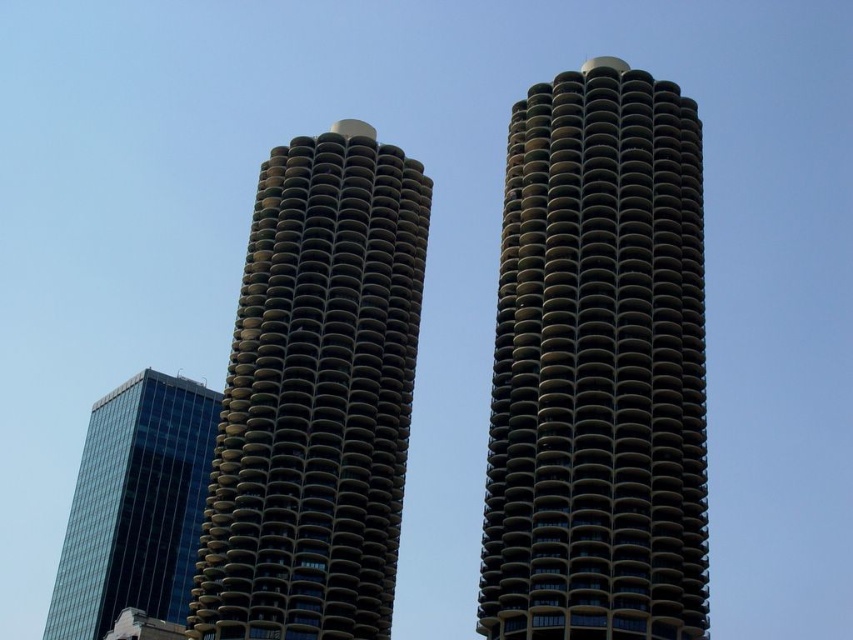
Who is more distant from viewer, (577, 504) or (97, 515)?

Point (97, 515)

Can you confirm if dark brown concrete tower at center is wider than transparent glass skyscraper at lower left?

In fact, dark brown concrete tower at center might be narrower than transparent glass skyscraper at lower left.

This screenshot has width=853, height=640. What are the coordinates of `dark brown concrete tower at center` in the screenshot? It's located at (598, 368).

At what (x,y) coordinates should I click in order to perform the action: click on dark brown concrete tower at center. Please return your answer as a coordinate pair (x, y). Image resolution: width=853 pixels, height=640 pixels. Looking at the image, I should click on (598, 368).

Based on the photo, who is positioned more to the left, green concrete tower at center or transparent glass skyscraper at lower left?

From the viewer's perspective, transparent glass skyscraper at lower left appears more on the left side.

Is point (364, 288) closer to camera compared to point (91, 609)?

Yes, it is.

Where is `green concrete tower at center`? green concrete tower at center is located at coordinates [x=316, y=397].

From the picture: Can you confirm if dark brown concrete tower at center is positioned to the right of green concrete tower at center?

Indeed, dark brown concrete tower at center is positioned on the right side of green concrete tower at center.

Between dark brown concrete tower at center and green concrete tower at center, which one appears on the left side from the viewer's perspective?

From the viewer's perspective, green concrete tower at center appears more on the left side.

Is point (485, 493) more distant than point (297, 484)?

No, it is in front of (297, 484).

What are the coordinates of `dark brown concrete tower at center` in the screenshot? It's located at (598, 368).